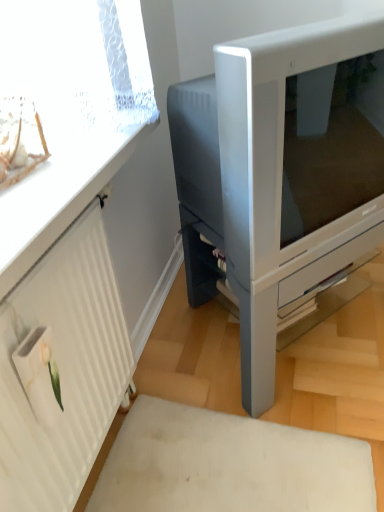
This screenshot has height=512, width=384. I want to click on unoccupied region to the right of white textured radiator at left, so click(x=211, y=435).